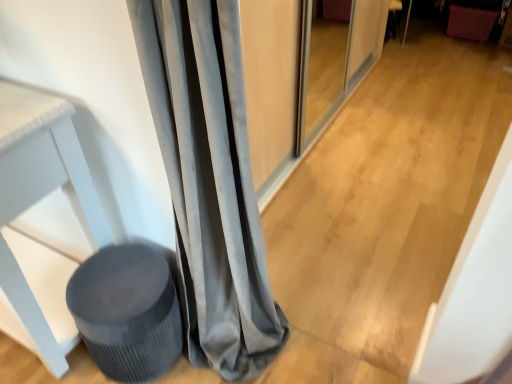
Question: Is velvet gray curtain at left oriented towards matte gray screen door at center?

Choices:
 (A) yes
 (B) no

Answer: (B)

Question: Considering the relative positions of velvet gray curtain at left and matte gray screen door at center in the image provided, is velvet gray curtain at left to the left of matte gray screen door at center from the viewer's perspective?

Choices:
 (A) yes
 (B) no

Answer: (A)

Question: Is velvet gray curtain at left at the right side of matte gray screen door at center?

Choices:
 (A) no
 (B) yes

Answer: (A)

Question: Is velvet gray curtain at left not within matte gray screen door at center?

Choices:
 (A) yes
 (B) no

Answer: (A)

Question: Can you confirm if velvet gray curtain at left is taller than matte gray screen door at center?

Choices:
 (A) yes
 (B) no

Answer: (A)

Question: Is the depth of velvet gray curtain at left less than that of matte gray screen door at center?

Choices:
 (A) no
 (B) yes

Answer: (B)

Question: Does matte gray screen door at center come in front of matte gray stool at lower left?

Choices:
 (A) yes
 (B) no

Answer: (B)

Question: From the image's perspective, is matte gray screen door at center on top of matte gray stool at lower left?

Choices:
 (A) no
 (B) yes

Answer: (B)

Question: Would you say matte gray screen door at center contains matte gray stool at lower left?

Choices:
 (A) yes
 (B) no

Answer: (B)

Question: Is matte gray screen door at center oriented away from matte gray stool at lower left?

Choices:
 (A) no
 (B) yes

Answer: (A)

Question: Can we say matte gray screen door at center lies outside matte gray stool at lower left?

Choices:
 (A) yes
 (B) no

Answer: (A)

Question: Is matte gray screen door at center smaller than matte gray stool at lower left?

Choices:
 (A) yes
 (B) no

Answer: (B)

Question: Does matte gray stool at lower left turn towards velvet gray curtain at left?

Choices:
 (A) yes
 (B) no

Answer: (B)